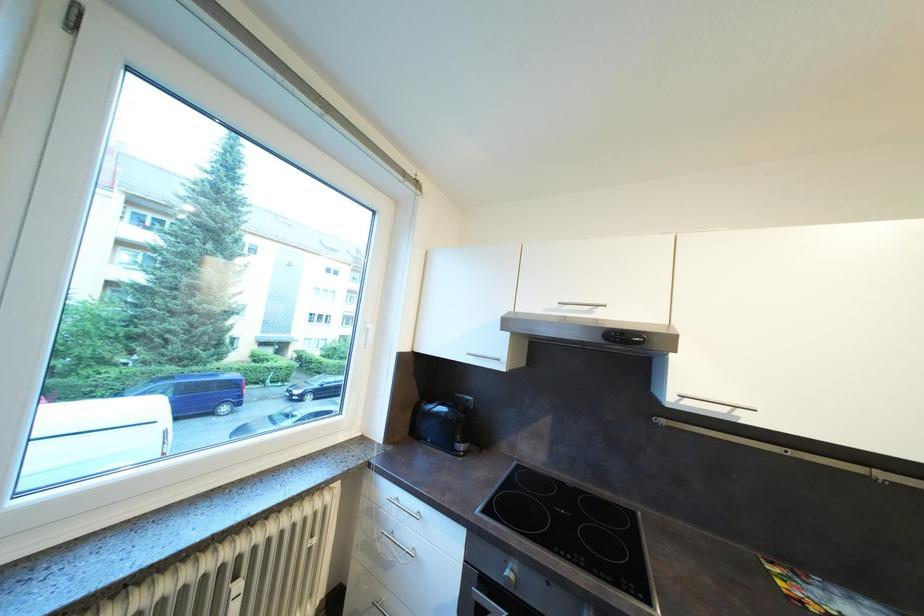
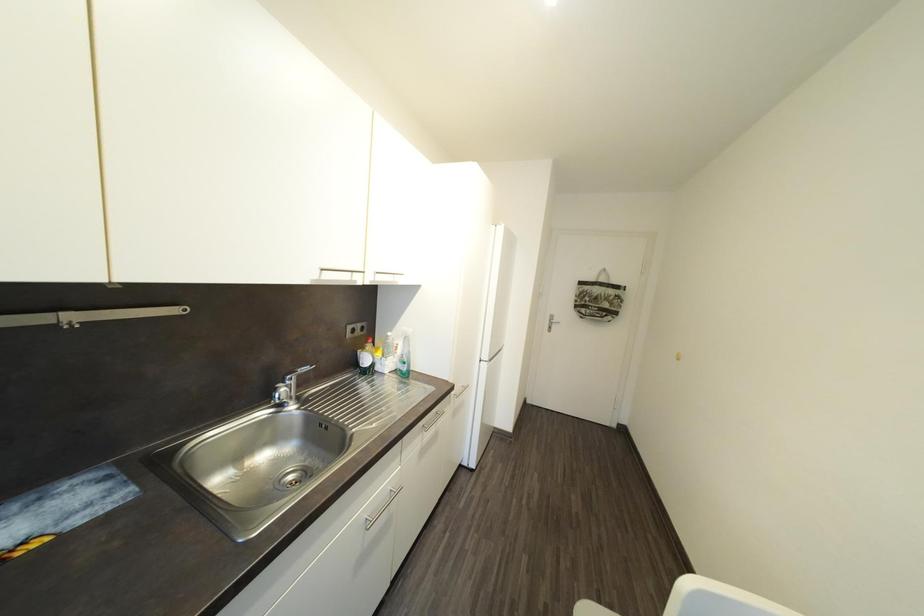
Question: The camera is either moving clockwise (left) or counter-clockwise (right) around the object. The first image is from the beginning of the video and the second image is from the end. Is the camera moving left or right when shooting the video?

Choices:
 (A) Left
 (B) Right

Answer: (A)